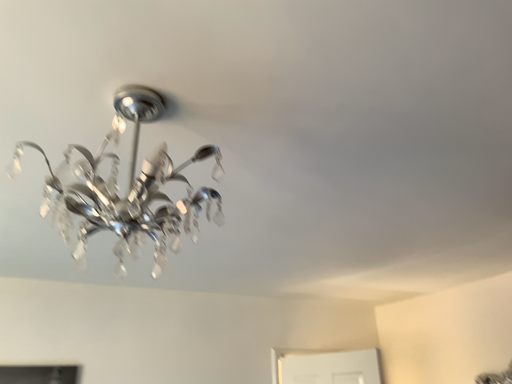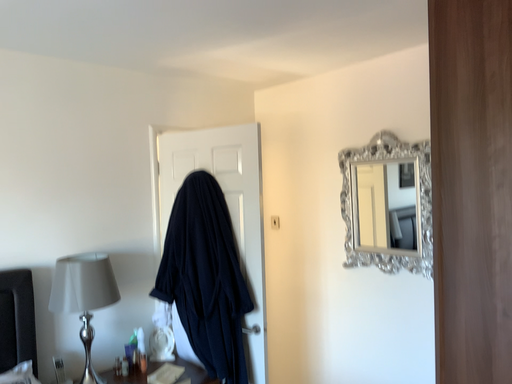
Question: How did the camera likely rotate when shooting the video?

Choices:
 (A) rotated upward
 (B) rotated downward

Answer: (B)